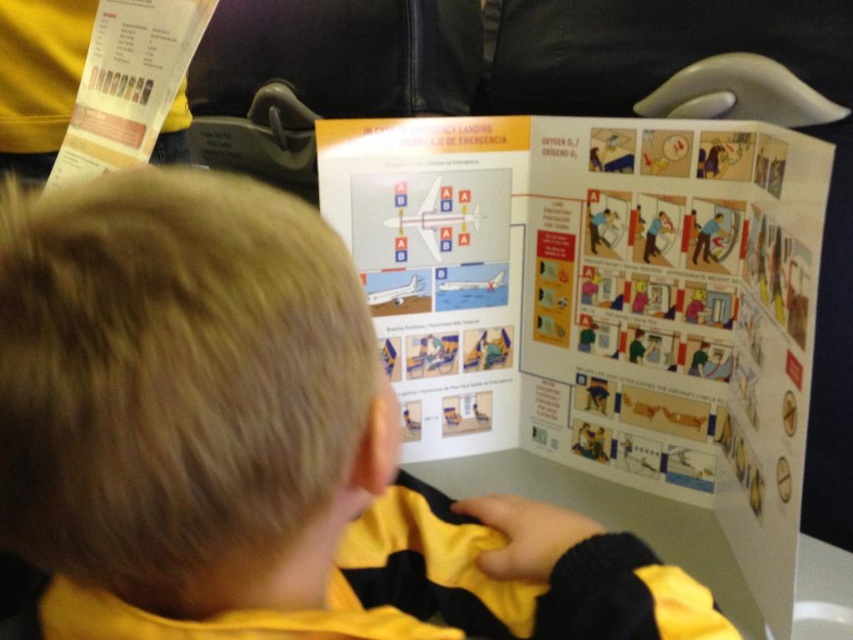
Question: Can you confirm if yellow fabric shirt at upper center is positioned below white paper at upper left?

Choices:
 (A) yes
 (B) no

Answer: (A)

Question: Which point appears closest to the camera in this image?

Choices:
 (A) 193,42
 (B) 630,291

Answer: (A)

Question: Is yellow fabric shirt at upper center to the left of white paper at center from the viewer's perspective?

Choices:
 (A) no
 (B) yes

Answer: (B)

Question: Estimate the real-world distances between objects in this image. Which object is farther from the white paper at center?

Choices:
 (A) yellow fabric shirt at upper center
 (B) white paper at upper left

Answer: (B)

Question: Which point is closer to the camera taking this photo?

Choices:
 (A) (15, 189)
 (B) (64, 141)
 (C) (451, 218)

Answer: (C)

Question: Considering the relative positions of white paper at center and white paper at upper left in the image provided, where is white paper at center located with respect to white paper at upper left?

Choices:
 (A) right
 (B) left

Answer: (A)